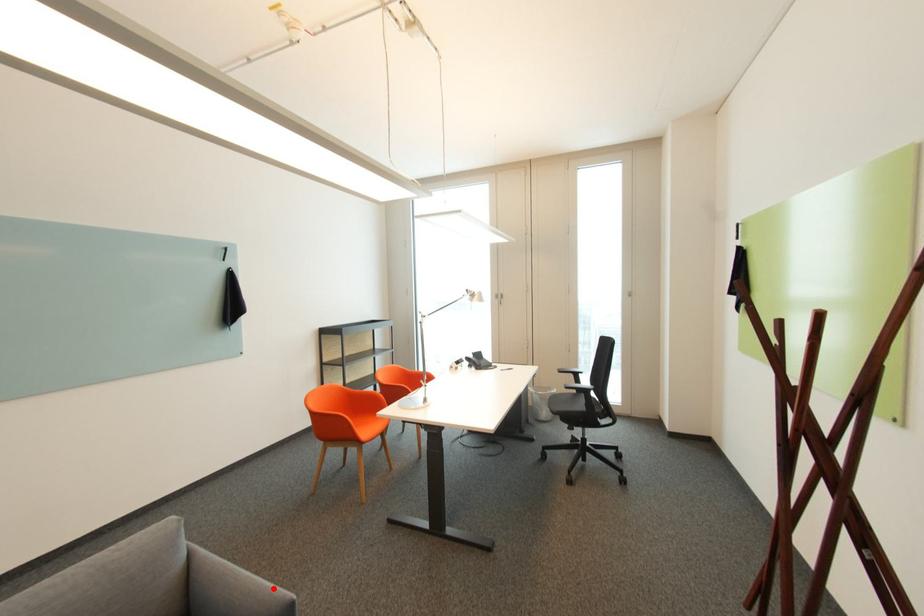
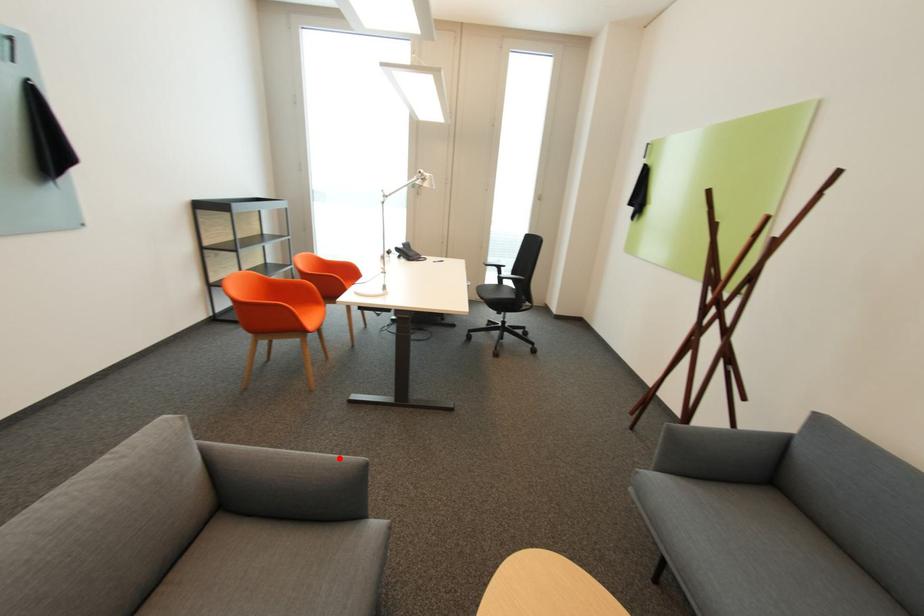
I am providing you with two images of the same scene from different viewpoints. A red point is marked on the first image and another point is marked on the second image. Are the points marked in image1 and image2 representing the same 3D position?

Yes